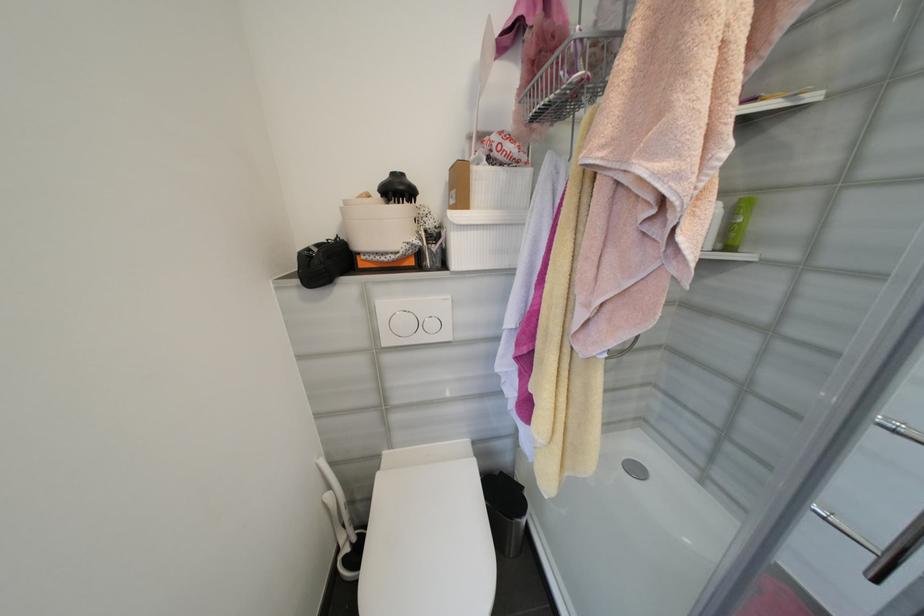
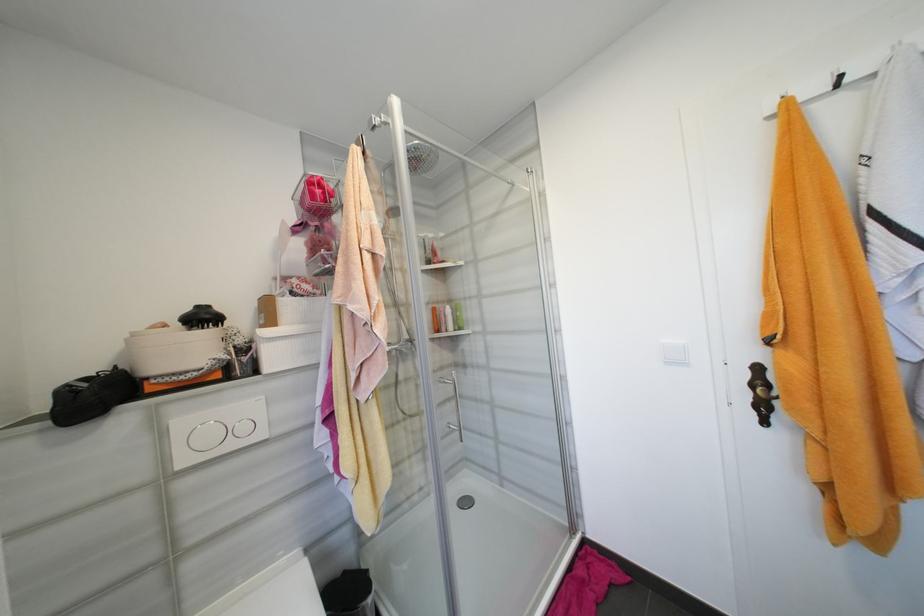
Where in the second image is the point corresponding to [393,342] from the first image?

(189, 463)